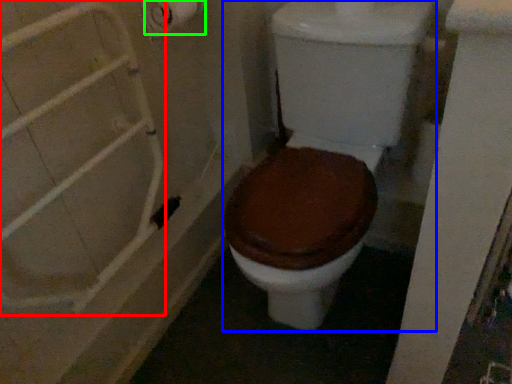
Question: Considering the real-world distances, which object is farthest from shower door (highlighted by a red box)? toilet (highlighted by a blue box) or toilet paper (highlighted by a green box)?

Choices:
 (A) toilet
 (B) toilet paper

Answer: (A)